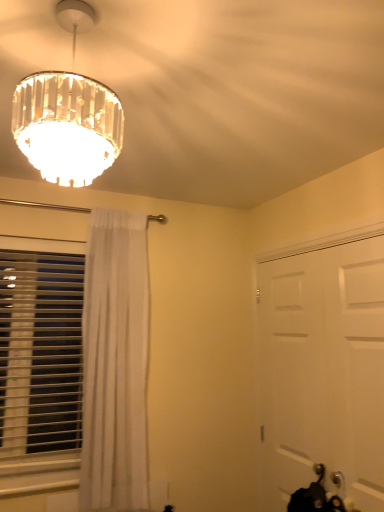
Question: Considering the positions of white plastic blinds at left and clear crystal chandelier at upper left in the image, is white plastic blinds at left bigger or smaller than clear crystal chandelier at upper left?

Choices:
 (A) big
 (B) small

Answer: (B)

Question: Considering their positions, is white plastic blinds at left located in front of or behind clear crystal chandelier at upper left?

Choices:
 (A) behind
 (B) front

Answer: (A)

Question: Based on their relative distances, which object is nearer to the clear crystal chandelier at upper left?

Choices:
 (A) white plastic blinds at left
 (B) white sheer curtain at left
 (C) white matte door at right

Answer: (C)

Question: Based on their relative distances, which object is nearer to the white sheer curtain at left?

Choices:
 (A) white plastic blinds at left
 (B) white matte door at right
 (C) clear crystal chandelier at upper left

Answer: (A)